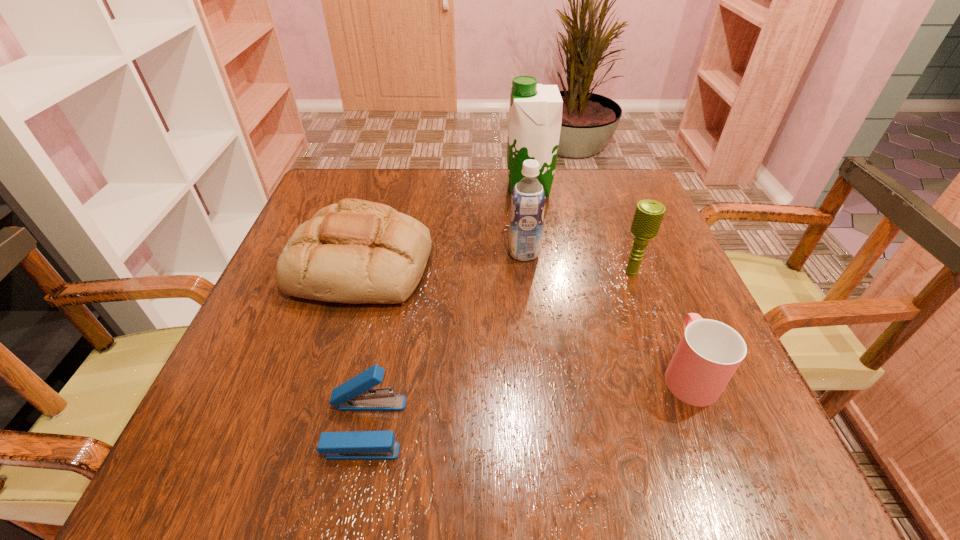
Image resolution: width=960 pixels, height=540 pixels. What are the coordinates of `object that is the fourth closest to the fourth tallest object` in the screenshot? It's located at (648, 216).

Locate an element on the screen. This screenshot has width=960, height=540. free point that satisfies the following two spatial constraints: 1. on the front-facing side of the farthest object; 2. on the back side of the third tallest object is located at coordinates (542, 272).

Identify the location of vacant space that satisfies the following two spatial constraints: 1. on the front-facing side of the farther soya milk; 2. on the side of the cup with the handle. This screenshot has width=960, height=540. (558, 373).

Image resolution: width=960 pixels, height=540 pixels. I want to click on blank area in the image that satisfies the following two spatial constraints: 1. on the label of the nearer soya milk; 2. on the front side of the stapler, so click(x=543, y=427).

Where is `vacant space that satisfies the following two spatial constraints: 1. on the side of the fifth tallest object with the handle; 2. on the label of the fifth shortest object`? The image size is (960, 540). vacant space that satisfies the following two spatial constraints: 1. on the side of the fifth tallest object with the handle; 2. on the label of the fifth shortest object is located at coordinates (638, 253).

The image size is (960, 540). Find the location of `free point that satisfies the following two spatial constraints: 1. on the front-facing side of the farthest object; 2. on the right side of the microphone`. free point that satisfies the following two spatial constraints: 1. on the front-facing side of the farthest object; 2. on the right side of the microphone is located at coordinates (542, 272).

I want to click on vacant space that satisfies the following two spatial constraints: 1. on the front-facing side of the microphone; 2. on the left side of the taller soya milk, so click(x=542, y=272).

Where is `free point that satisfies the following two spatial constraints: 1. on the front-facing side of the tallest object; 2. on the side of the cup with the handle`? This screenshot has width=960, height=540. free point that satisfies the following two spatial constraints: 1. on the front-facing side of the tallest object; 2. on the side of the cup with the handle is located at coordinates (558, 373).